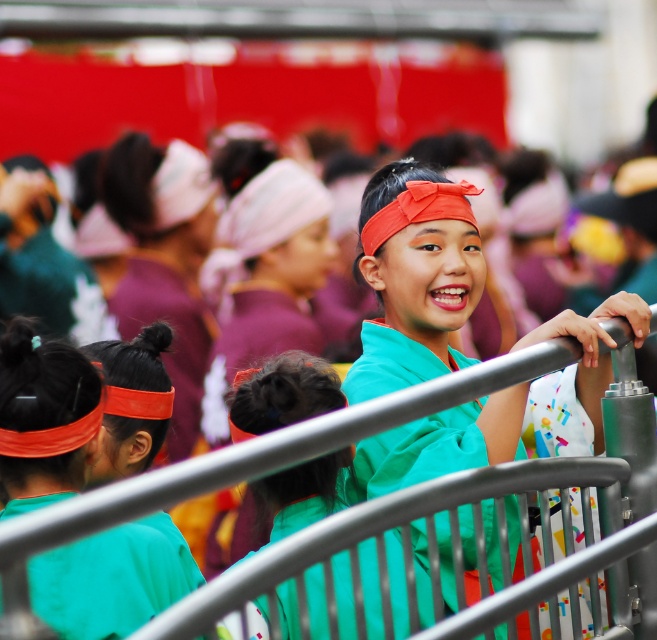
You are organizing a costume party and need to ensure that all accessories fit properly. You have a matte green shirt at center and a matte orange headband at left. Which item requires more space to store?

The matte green shirt at center requires more space to store because it is bigger than the matte orange headband at left.

You are attending a cultural festival and see the matte green shirt at center and the matte orange headband at left. Which one is positioned more to the right side of the image?

The matte green shirt at center is positioned more to the right side of the image than the matte orange headband at left.